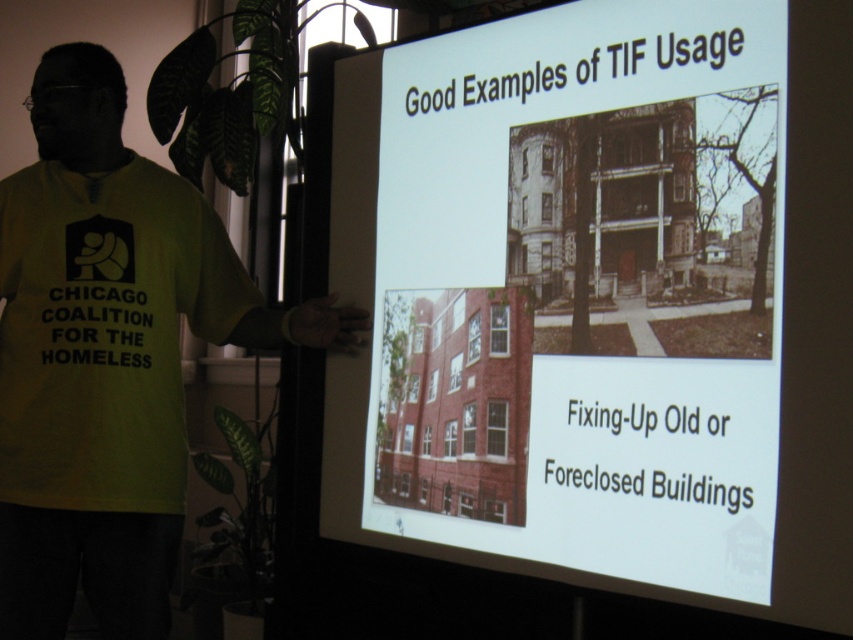
Does point (691, 536) come behind point (86, 150)?

No, (691, 536) is closer to viewer.

Who is taller, matte brick building at center or yellow t-shirt at left?

Standing taller between the two is yellow t-shirt at left.

The width and height of the screenshot is (853, 640). In order to click on matte brick building at center in this screenshot , I will do `click(584, 291)`.

Measure the distance between matte brick building at center and yellow cotton t-shirt at left.

matte brick building at center is 69.68 centimeters from yellow cotton t-shirt at left.

Is matte brick building at center smaller than yellow cotton t-shirt at left?

No, matte brick building at center is not smaller than yellow cotton t-shirt at left.

This screenshot has width=853, height=640. What do you see at coordinates (584, 291) in the screenshot? I see `matte brick building at center` at bounding box center [584, 291].

Where is `matte brick building at center`? This screenshot has height=640, width=853. matte brick building at center is located at coordinates (584, 291).

What do you see at coordinates (108, 355) in the screenshot? I see `yellow t-shirt at left` at bounding box center [108, 355].

Who is shorter, yellow t-shirt at left or yellow cotton t-shirt at left?

Standing shorter between the two is yellow cotton t-shirt at left.

Is point (22, 424) positioned after point (39, 358)?

No, it is in front of (39, 358).

Find the location of a particular element. yellow t-shirt at left is located at coordinates (108, 355).